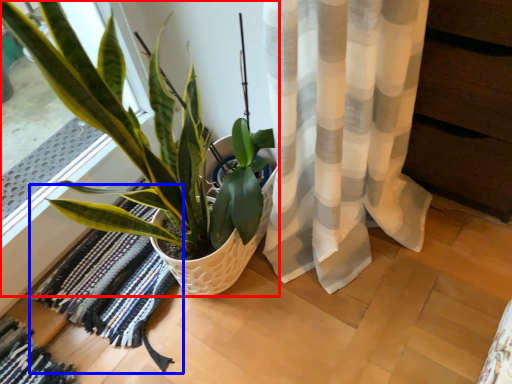
Question: Which of the following is the farthest to the observer, houseplant (highlighted by a red box) or mat (highlighted by a blue box)?

Choices:
 (A) houseplant
 (B) mat

Answer: (B)